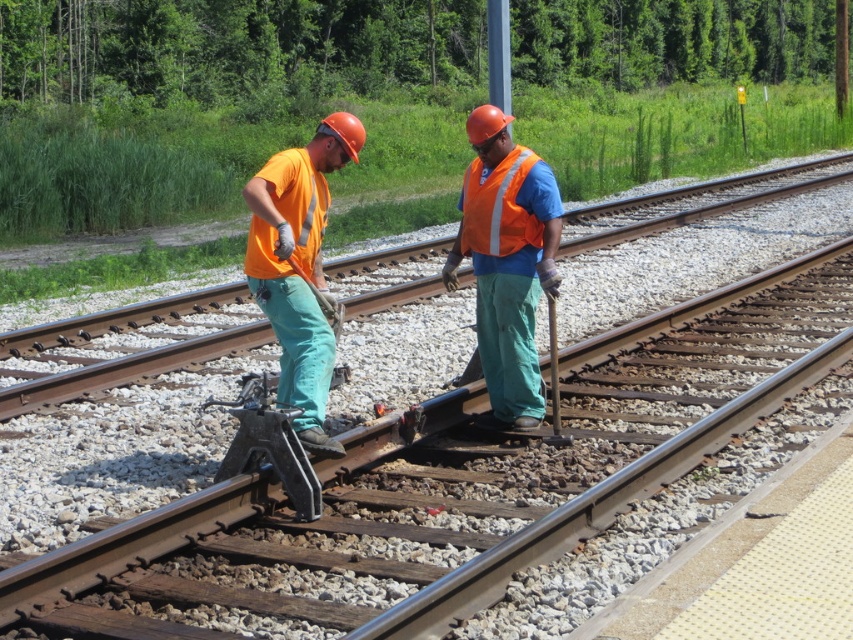
You are a train conductor passing by the scene and notice two workers. Which object, the matte orange shirt at center or the reflective orange safety vest at center, is positioned lower from your viewpoint?

The matte orange shirt at center is located below the reflective orange safety vest at center, so the matte orange shirt at center is positioned lower from your viewpoint.

Looking at this image, you are a supervisor observing the workers from a distance. You need to locate the worker wearing the matte orange shirt at center. According to the coordinates provided, where exactly is this worker positioned on the image?

The matte orange shirt at center is located at point coordinates of (x=299, y=266).